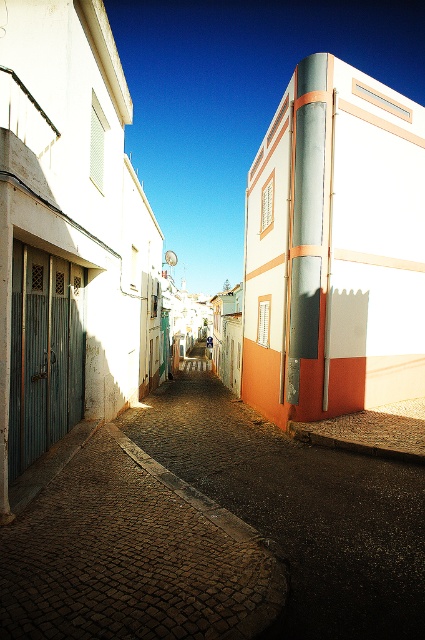
You are a delivery person with a cart that is 1 meter wide. You need to navigate through the narrow street scene shown in the image. Can your cart pass between the metallic silver pipe at center and the cobblestone street at center without touching either?

The metallic silver pipe at center might be wider than the cobblestone street at center, so there might not be enough space for the cart to pass safely without touching either object. It is uncertain and requires further measurement.

You are a delivery person with a cart that is 30 inches wide. You need to navigate through the narrow street scene shown in the image. Can your cart fit through the space between the cobblestone alley at center and the cobblestone street at center?

The distance between the cobblestone alley at center and the cobblestone street at center is 28.49 inches, which is narrower than your 30 inches wide cart. Therefore, your cart cannot fit through that space.

You are a delivery person with a 2.5 meter long ladder that needs to be carried horizontally. You are on the cobblestone street at center and need to pass by the metallic silver pipe at center. Can you safely carry the ladder past the pipe without hitting it?

The distance between the metallic silver pipe at center and the cobblestone street at center is 6.55 meters. Since the ladder is only 2.5 meters long, it can be safely carried horizontally past the pipe as the vertical clearance is sufficient.